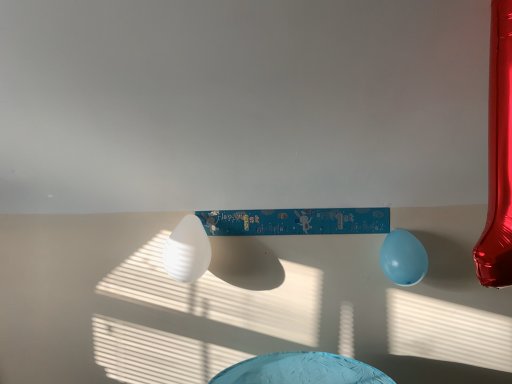
The height and width of the screenshot is (384, 512). Identify the location of white matte balloon at center, marked as the 1th balloon in a left-to-right arrangement. (187, 251).

Describe the element at coordinates (187, 251) in the screenshot. I see `white matte balloon at center, the second balloon from the right` at that location.

Find the location of a particular element. The height and width of the screenshot is (384, 512). light blue rubber balloon at lower right, the 2th balloon viewed from the left is located at coordinates (403, 258).

Image resolution: width=512 pixels, height=384 pixels. Describe the element at coordinates (403, 258) in the screenshot. I see `light blue rubber balloon at lower right, the 2th balloon viewed from the left` at that location.

The height and width of the screenshot is (384, 512). What are the coordinates of `white matte balloon at center, the second balloon from the right` in the screenshot? It's located at (187, 251).

Is white matte balloon at center, the second balloon from the right, at the left side of light blue rubber balloon at lower right, the 1th balloon when ordered from right to left?

Indeed, white matte balloon at center, the second balloon from the right, is positioned on the left side of light blue rubber balloon at lower right, the 1th balloon when ordered from right to left.

Who is more distant, white matte balloon at center, the second balloon from the right, or light blue rubber balloon at lower right, the 1th balloon when ordered from right to left?

light blue rubber balloon at lower right, the 1th balloon when ordered from right to left, is behind.

Is point (172, 266) closer to camera compared to point (403, 232)?

Yes, point (172, 266) is in front of point (403, 232).

From the image's perspective, is white matte balloon at center, the second balloon from the right, located above or below light blue rubber balloon at lower right, the 2th balloon viewed from the left?

Clearly, from the image's perspective, white matte balloon at center, the second balloon from the right, is above light blue rubber balloon at lower right, the 2th balloon viewed from the left.

From a real-world perspective, between white matte balloon at center, the second balloon from the right, and light blue rubber balloon at lower right, the 2th balloon viewed from the left, who is vertically higher?

From a 3D spatial view, white matte balloon at center, the second balloon from the right, is above.

Does white matte balloon at center, the second balloon from the right, have a lesser width compared to light blue rubber balloon at lower right, the 2th balloon viewed from the left?

Incorrect, the width of white matte balloon at center, the second balloon from the right, is not less than that of light blue rubber balloon at lower right, the 2th balloon viewed from the left.

Considering the sizes of objects white matte balloon at center, the second balloon from the right, and light blue rubber balloon at lower right, the 2th balloon viewed from the left, in the image provided, who is taller, white matte balloon at center, the second balloon from the right, or light blue rubber balloon at lower right, the 2th balloon viewed from the left,?

With more height is white matte balloon at center, the second balloon from the right.

Does white matte balloon at center, the second balloon from the right, have a larger size compared to light blue rubber balloon at lower right, the 2th balloon viewed from the left?

Correct, white matte balloon at center, the second balloon from the right, is larger in size than light blue rubber balloon at lower right, the 2th balloon viewed from the left.

Is white matte balloon at center, the second balloon from the right, spatially inside light blue rubber balloon at lower right, the 2th balloon viewed from the left, or outside of it?

The correct answer is: outside.

Based on the photo, does white matte balloon at center, the second balloon from the right, touch light blue rubber balloon at lower right, the 1th balloon when ordered from right to left?

They are not placed beside each other.

Could you tell me if white matte balloon at center, marked as the 1th balloon in a left-to-right arrangement, is facing light blue rubber balloon at lower right, the 2th balloon viewed from the left?

No, white matte balloon at center, marked as the 1th balloon in a left-to-right arrangement, is not turned towards light blue rubber balloon at lower right, the 2th balloon viewed from the left.

How different are the orientations of white matte balloon at center, the second balloon from the right, and light blue rubber balloon at lower right, the 2th balloon viewed from the left, in degrees?

white matte balloon at center, the second balloon from the right, and light blue rubber balloon at lower right, the 2th balloon viewed from the left, are facing 0.729 degrees away from each other.

How much distance is there between white matte balloon at center, marked as the 1th balloon in a left-to-right arrangement, and light blue rubber balloon at lower right, the 1th balloon when ordered from right to left?

white matte balloon at center, marked as the 1th balloon in a left-to-right arrangement, and light blue rubber balloon at lower right, the 1th balloon when ordered from right to left, are 32.00 inches apart from each other.

Where is `balloon that appears above the light blue rubber balloon at lower right, the 2th balloon viewed from the left (from a real-world perspective)`? balloon that appears above the light blue rubber balloon at lower right, the 2th balloon viewed from the left (from a real-world perspective) is located at coordinates (187, 251).

Can you confirm if light blue rubber balloon at lower right, the 1th balloon when ordered from right to left, is positioned to the right of white matte balloon at center, the second balloon from the right?

Yes, light blue rubber balloon at lower right, the 1th balloon when ordered from right to left, is to the right of white matte balloon at center, the second balloon from the right.

Considering the positions of objects light blue rubber balloon at lower right, the 1th balloon when ordered from right to left, and white matte balloon at center, the second balloon from the right, in the image provided, who is in front, light blue rubber balloon at lower right, the 1th balloon when ordered from right to left, or white matte balloon at center, the second balloon from the right,?

white matte balloon at center, the second balloon from the right, is more forward.

Considering the positions of points (391, 265) and (166, 258), is point (391, 265) closer to camera compared to point (166, 258)?

Yes, point (391, 265) is in front of point (166, 258).

From the image's perspective, is light blue rubber balloon at lower right, the 1th balloon when ordered from right to left, located above or below white matte balloon at center, the second balloon from the right?

light blue rubber balloon at lower right, the 1th balloon when ordered from right to left, is situated lower than white matte balloon at center, the second balloon from the right, in the image.

From a real-world perspective, does light blue rubber balloon at lower right, the 1th balloon when ordered from right to left, stand above white matte balloon at center, marked as the 1th balloon in a left-to-right arrangement?

No.

Considering the relative sizes of light blue rubber balloon at lower right, the 2th balloon viewed from the left, and white matte balloon at center, marked as the 1th balloon in a left-to-right arrangement, in the image provided, is light blue rubber balloon at lower right, the 2th balloon viewed from the left, thinner than white matte balloon at center, marked as the 1th balloon in a left-to-right arrangement,?

Indeed, light blue rubber balloon at lower right, the 2th balloon viewed from the left, has a lesser width compared to white matte balloon at center, marked as the 1th balloon in a left-to-right arrangement.

Is light blue rubber balloon at lower right, the 1th balloon when ordered from right to left, taller or shorter than white matte balloon at center, marked as the 1th balloon in a left-to-right arrangement?

light blue rubber balloon at lower right, the 1th balloon when ordered from right to left, is shorter than white matte balloon at center, marked as the 1th balloon in a left-to-right arrangement.

Looking at this image, is light blue rubber balloon at lower right, the 1th balloon when ordered from right to left, smaller than white matte balloon at center, the second balloon from the right?

Indeed, light blue rubber balloon at lower right, the 1th balloon when ordered from right to left, has a smaller size compared to white matte balloon at center, the second balloon from the right.

Is light blue rubber balloon at lower right, the 2th balloon viewed from the left, spatially inside white matte balloon at center, marked as the 1th balloon in a left-to-right arrangement, or outside of it?

The correct answer is: outside.

Is light blue rubber balloon at lower right, the 1th balloon when ordered from right to left, with white matte balloon at center, the second balloon from the right?

No, light blue rubber balloon at lower right, the 1th balloon when ordered from right to left, is not touching white matte balloon at center, the second balloon from the right.

Is light blue rubber balloon at lower right, the 2th balloon viewed from the left, oriented towards white matte balloon at center, the second balloon from the right?

No, light blue rubber balloon at lower right, the 2th balloon viewed from the left, does not turn towards white matte balloon at center, the second balloon from the right.

How many degrees apart are the facing directions of light blue rubber balloon at lower right, the 2th balloon viewed from the left, and white matte balloon at center, marked as the 1th balloon in a left-to-right arrangement?

light blue rubber balloon at lower right, the 2th balloon viewed from the left, and white matte balloon at center, marked as the 1th balloon in a left-to-right arrangement, are facing 0.729 degrees away from each other.

Where is `balloon that appears on the right of white matte balloon at center, marked as the 1th balloon in a left-to-right arrangement`? The height and width of the screenshot is (384, 512). balloon that appears on the right of white matte balloon at center, marked as the 1th balloon in a left-to-right arrangement is located at coordinates (403, 258).

I want to click on balloon positioned vertically above the light blue rubber balloon at lower right, the 1th balloon when ordered from right to left (from a real-world perspective), so click(187, 251).

Locate an element on the screen. This screenshot has height=384, width=512. balloon behind the white matte balloon at center, marked as the 1th balloon in a left-to-right arrangement is located at coordinates (403, 258).